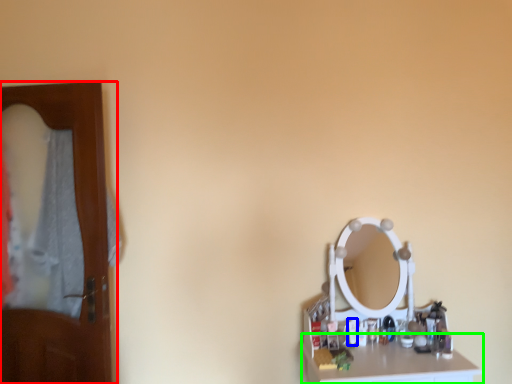
Question: Which is farther away from door (highlighted by a red box)? toiletry (highlighted by a blue box) or counter top (highlighted by a green box)?

Choices:
 (A) toiletry
 (B) counter top

Answer: (A)